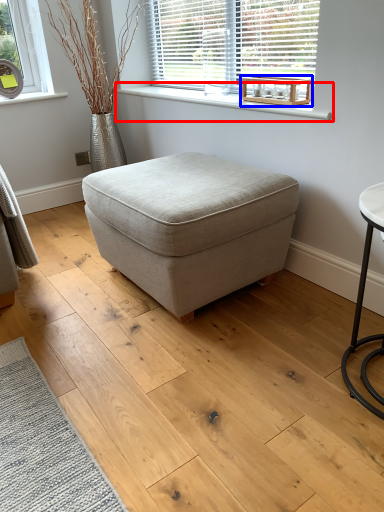
Question: Which object appears farthest to the camera in this image, window sill (highlighted by a red box) or round table (highlighted by a blue box)?

Choices:
 (A) window sill
 (B) round table

Answer: (B)